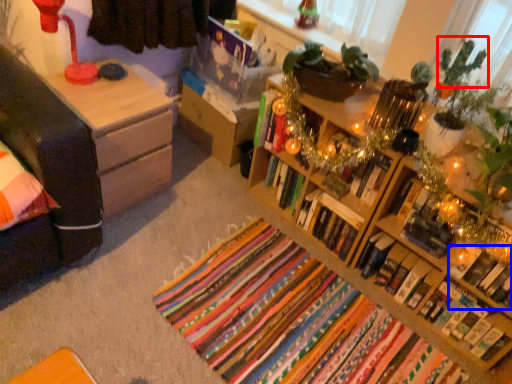
Question: Which object is closer to the camera taking this photo, christmas decoration (highlighted by a red box) or book (highlighted by a blue box)?

Choices:
 (A) christmas decoration
 (B) book

Answer: (A)